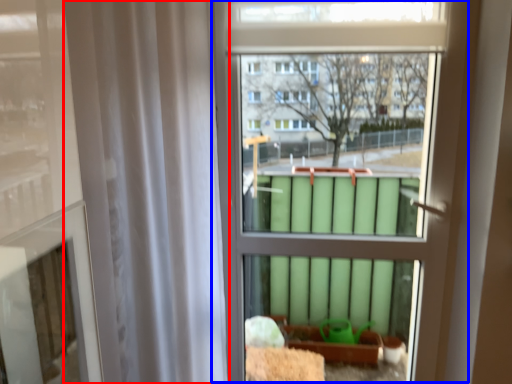
Question: Which point is closer to the camera, shower curtain (highlighted by a red box) or bay window (highlighted by a blue box)?

Choices:
 (A) shower curtain
 (B) bay window

Answer: (A)